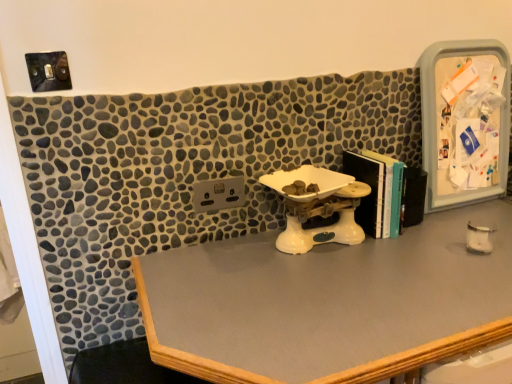
Question: Considering the relative positions of smooth gray desk at center and plastic/transparent medicine cabinet at right in the image provided, is smooth gray desk at center in front of plastic/transparent medicine cabinet at right?

Choices:
 (A) yes
 (B) no

Answer: (A)

Question: Considering the relative sizes of smooth gray desk at center and plastic/transparent medicine cabinet at right in the image provided, is smooth gray desk at center taller than plastic/transparent medicine cabinet at right?

Choices:
 (A) no
 (B) yes

Answer: (B)

Question: From the image's perspective, would you say smooth gray desk at center is shown under plastic/transparent medicine cabinet at right?

Choices:
 (A) yes
 (B) no

Answer: (A)

Question: Can you confirm if smooth gray desk at center is positioned to the left of plastic/transparent medicine cabinet at right?

Choices:
 (A) yes
 (B) no

Answer: (A)

Question: Would you consider smooth gray desk at center to be distant from plastic/transparent medicine cabinet at right?

Choices:
 (A) yes
 (B) no

Answer: (B)

Question: Considering the relative sizes of smooth gray desk at center and plastic/transparent medicine cabinet at right in the image provided, is smooth gray desk at center bigger than plastic/transparent medicine cabinet at right?

Choices:
 (A) no
 (B) yes

Answer: (B)

Question: Is hardcover books at center-right to the left of white plastic scale at center from the viewer's perspective?

Choices:
 (A) yes
 (B) no

Answer: (B)

Question: Considering the relative sizes of hardcover books at center-right and white plastic scale at center in the image provided, is hardcover books at center-right thinner than white plastic scale at center?

Choices:
 (A) no
 (B) yes

Answer: (B)

Question: From a real-world perspective, is hardcover books at center-right physically below white plastic scale at center?

Choices:
 (A) yes
 (B) no

Answer: (B)

Question: Is hardcover books at center-right outside white plastic scale at center?

Choices:
 (A) no
 (B) yes

Answer: (B)

Question: Is hardcover books at center-right with white plastic scale at center?

Choices:
 (A) yes
 (B) no

Answer: (B)

Question: Is hardcover books at center-right bigger than white plastic scale at center?

Choices:
 (A) yes
 (B) no

Answer: (B)

Question: Is white plastic scale at center bigger than smooth gray desk at center?

Choices:
 (A) no
 (B) yes

Answer: (A)